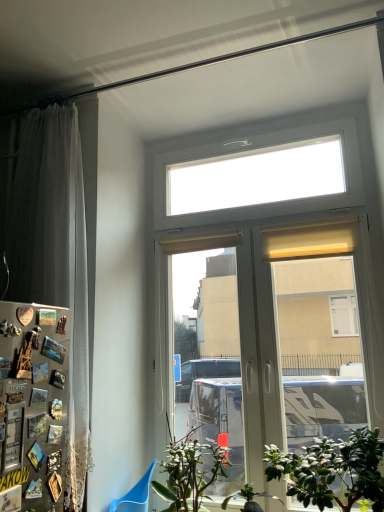
Question: Does white plastic window at center appear on the right side of metallic silver fridge at left?

Choices:
 (A) yes
 (B) no

Answer: (A)

Question: Can you confirm if white plastic window at center is positioned to the left of metallic silver fridge at left?

Choices:
 (A) yes
 (B) no

Answer: (B)

Question: Does white plastic window at center have a lesser width compared to metallic silver fridge at left?

Choices:
 (A) no
 (B) yes

Answer: (A)

Question: From a real-world perspective, does white plastic window at center sit lower than metallic silver fridge at left?

Choices:
 (A) no
 (B) yes

Answer: (A)

Question: Would you say white plastic window at center is a long distance from metallic silver fridge at left?

Choices:
 (A) no
 (B) yes

Answer: (A)

Question: From a real-world perspective, relative to green leafy plant at lower right, which is the third houseplant in left-to-right order, is blue plastic armchair at lower left vertically above or below?

Choices:
 (A) below
 (B) above

Answer: (A)

Question: Is blue plastic armchair at lower left inside the boundaries of green leafy plant at lower right, the 1th houseplant in the right-to-left sequence, or outside?

Choices:
 (A) inside
 (B) outside

Answer: (B)

Question: Is point (135, 504) closer or farther from the camera than point (354, 446)?

Choices:
 (A) farther
 (B) closer

Answer: (A)

Question: Would you say blue plastic armchair at lower left is to the left or to the right of green leafy plant at lower right, which is the third houseplant in left-to-right order, in the picture?

Choices:
 (A) right
 (B) left

Answer: (B)

Question: Considering the positions of green leafy plant at lower center, which is the second houseplant from right to left, and white sheer curtain at left in the image, is green leafy plant at lower center, which is the second houseplant from right to left, wider or thinner than white sheer curtain at left?

Choices:
 (A) wide
 (B) thin

Answer: (A)

Question: Is green leafy plant at lower center, the 2th houseplant positioned from the left, taller or shorter than white sheer curtain at left?

Choices:
 (A) tall
 (B) short

Answer: (B)

Question: From the image's perspective, relative to white sheer curtain at left, is green leafy plant at lower center, the 2th houseplant positioned from the left, above or below?

Choices:
 (A) below
 (B) above

Answer: (A)

Question: Would you say green leafy plant at lower center, which is the second houseplant from right to left, is to the left or to the right of white sheer curtain at left in the picture?

Choices:
 (A) right
 (B) left

Answer: (A)

Question: In the image, is blue plastic armchair at lower left positioned in front of or behind green leafy plant at lower center, which is the second houseplant from right to left?

Choices:
 (A) front
 (B) behind

Answer: (B)

Question: In terms of size, does blue plastic armchair at lower left appear bigger or smaller than green leafy plant at lower center, the 2th houseplant positioned from the left?

Choices:
 (A) small
 (B) big

Answer: (B)